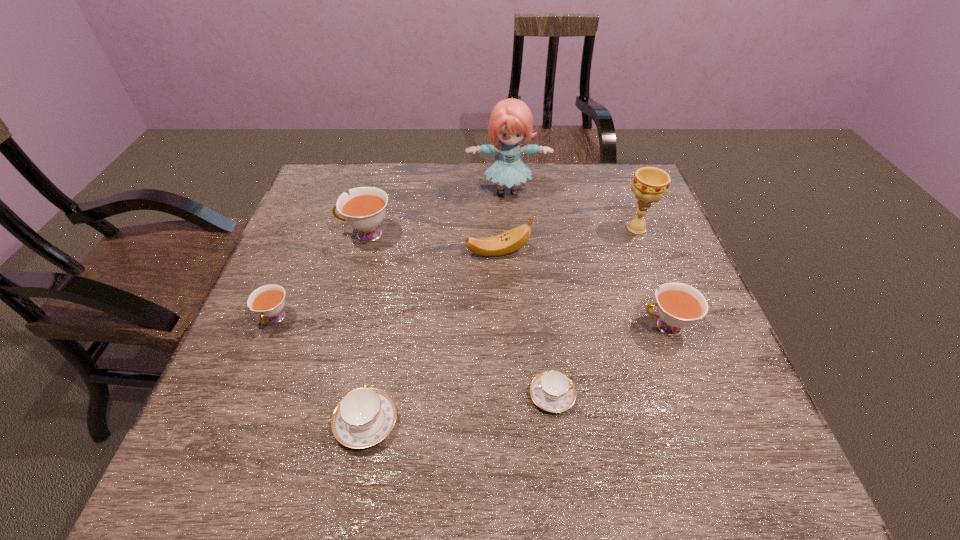
You are a GUI agent. You are given a task and a screenshot of the screen. Output one action in this format:
    pyautogui.click(x=<x>, y=<y>)
    Task: Click on the blue doll
    The width and height of the screenshot is (960, 540).
    Given the screenshot: What is the action you would take?
    tap(511, 121)

Find the location of a particular element. The image size is (960, 540). the farthest object is located at coordinates (x=511, y=121).

The width and height of the screenshot is (960, 540). In order to click on the seventh shortest object in this screenshot , I will do `click(650, 184)`.

At what (x,y) coordinates should I click in order to perform the action: click on the farthest teacup. Please return your answer as a coordinate pair (x, y). The height and width of the screenshot is (540, 960). Looking at the image, I should click on (364, 209).

The height and width of the screenshot is (540, 960). Find the location of `the biggest white teacup`. the biggest white teacup is located at coordinates (364, 209).

Identify the location of banana. (512, 240).

At what (x,y) coordinates should I click in order to perform the action: click on the second tallest teacup. Please return your answer as a coordinate pair (x, y). The width and height of the screenshot is (960, 540). Looking at the image, I should click on (679, 305).

Where is `the rightmost teacup`? This screenshot has height=540, width=960. the rightmost teacup is located at coordinates (679, 305).

The image size is (960, 540). I want to click on the leftmost teacup, so click(x=268, y=301).

Where is `the leftmost object`? This screenshot has width=960, height=540. the leftmost object is located at coordinates (268, 301).